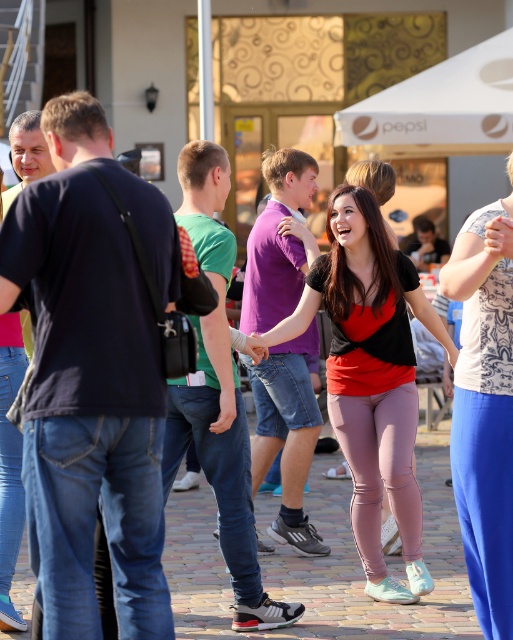
Does matte black top at center appear under printed cotton blouse at right?

Indeed, matte black top at center is positioned under printed cotton blouse at right.

Is point (374, 230) less distant than point (480, 403)?

No.

Locate an element on the screen. matte black top at center is located at coordinates (370, 376).